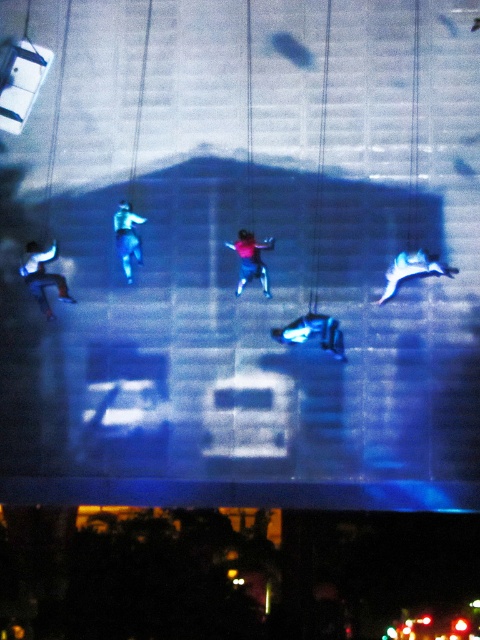
You are an observer standing in front of the projected image on the building facade. You notice two figures dressed in blue clothing. The first is wearing matte blue jeans at lower left, and the second is wearing blue fabric pants at center. Which of these two figures appears taller in the projection?

The matte blue jeans at lower left is taller than blue fabric pants at center according to the description.

You are a delivery drone that needs to pass between the shiny metallic car at center and the blue fabric figure at center. The drone is 1.2 meters wide. Can you safely navigate through the space between them?

The shiny metallic car at center might be wider than blue fabric figure at center, so the space between them may not be sufficient for the drone to pass safely. It is recommended to choose a different route to avoid potential collisions.